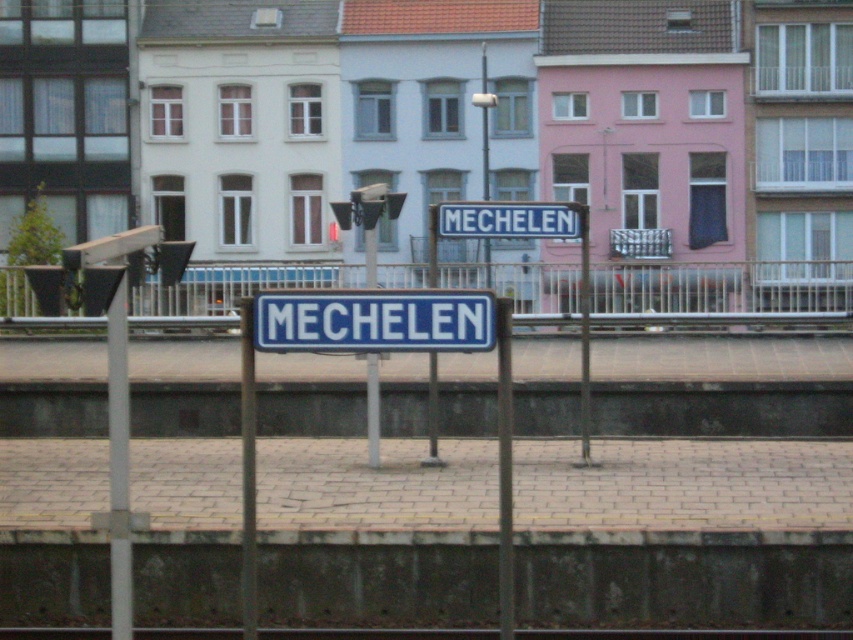
Does metallic gray train track at center appear under blue metallic sign at center?

Indeed, metallic gray train track at center is positioned under blue metallic sign at center.

Is metallic gray train track at center bigger than blue metallic sign at center?

Yes, metallic gray train track at center is bigger than blue metallic sign at center.

At what (x,y) coordinates should I click in order to perform the action: click on metallic gray train track at center. Please return your answer as a coordinate pair (x, y). Looking at the image, I should click on (682, 634).

Where is `metallic gray train track at center`? Image resolution: width=853 pixels, height=640 pixels. metallic gray train track at center is located at coordinates (682, 634).

Is point (759, 301) more distant than point (21, 636)?

Yes, point (759, 301) is behind point (21, 636).

Does point (772, 312) lie in front of point (442, 630)?

No.

Who is more forward, (236, 289) or (607, 632)?

Point (607, 632)

Identify the location of blue metal rail at center. This screenshot has width=853, height=640. (722, 292).

Is point (16, 308) behind point (517, 218)?

Yes, point (16, 308) is behind point (517, 218).

Does blue metal rail at center lie behind blue metallic sign at center?

No, it is not.

In order to click on blue metal rail at center in this screenshot , I will do `click(722, 292)`.